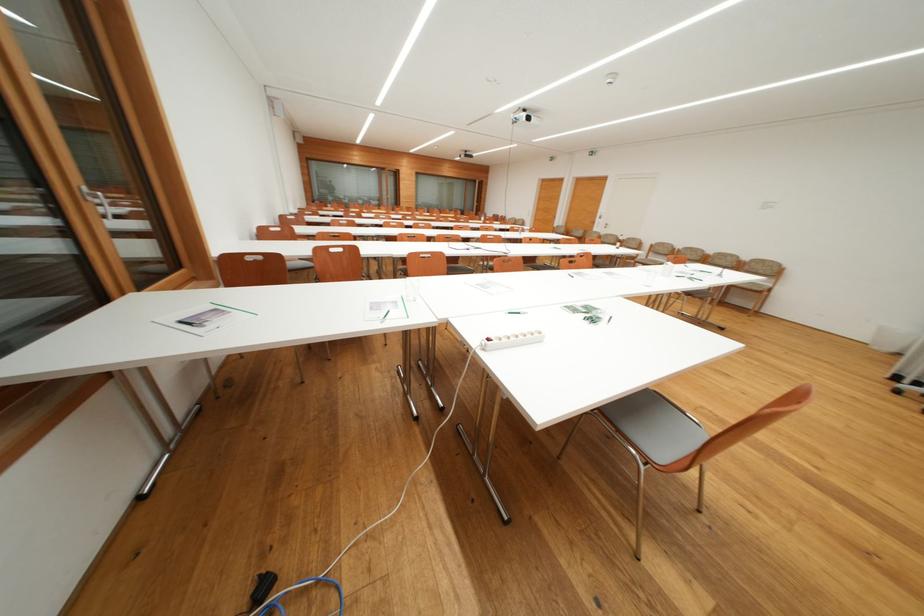
The width and height of the screenshot is (924, 616). Describe the element at coordinates (511, 339) in the screenshot. I see `the white power strip` at that location.